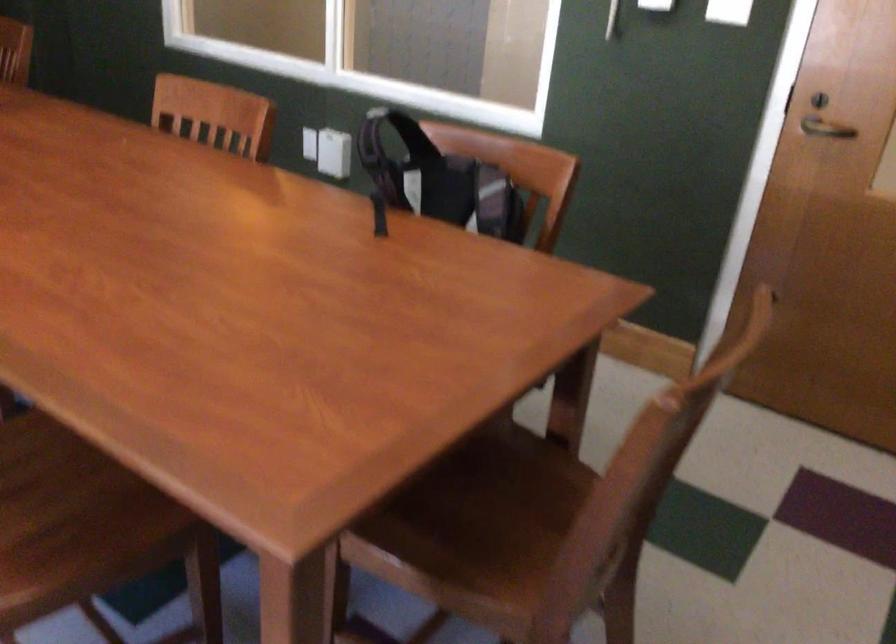
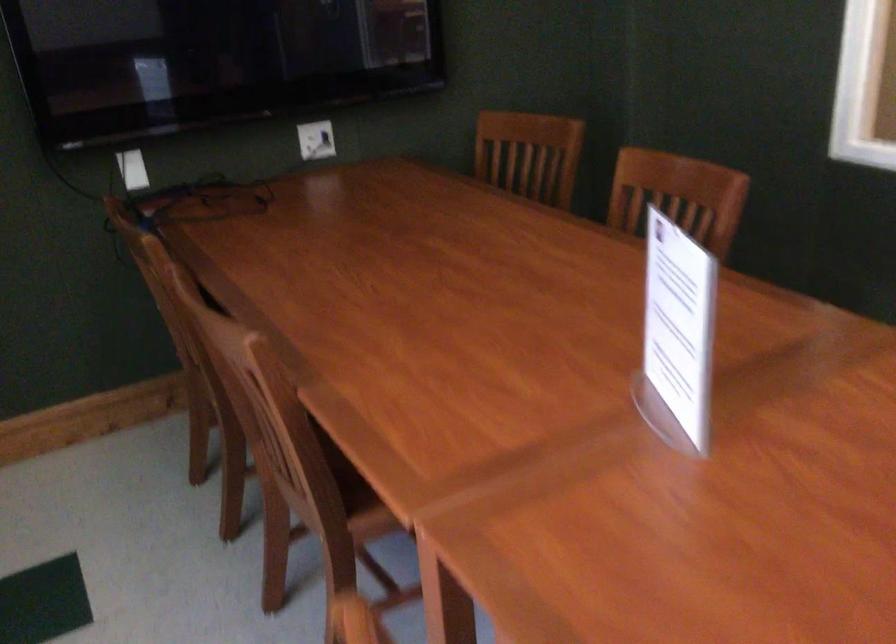
Looking at this image, in a continuous first-person perspective shot, in which direction is the camera moving?

The movement direction of the cameraman is left, forward.